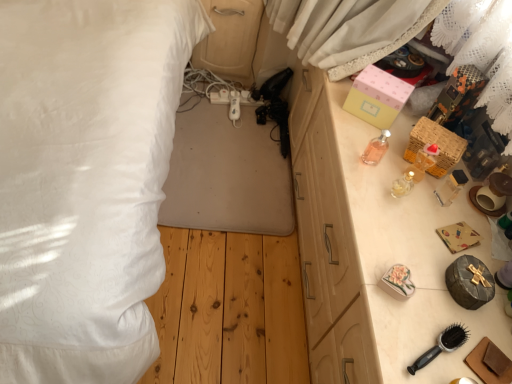
This screenshot has height=384, width=512. I want to click on space that is in front of pink glass perfume at upper right, so click(370, 198).